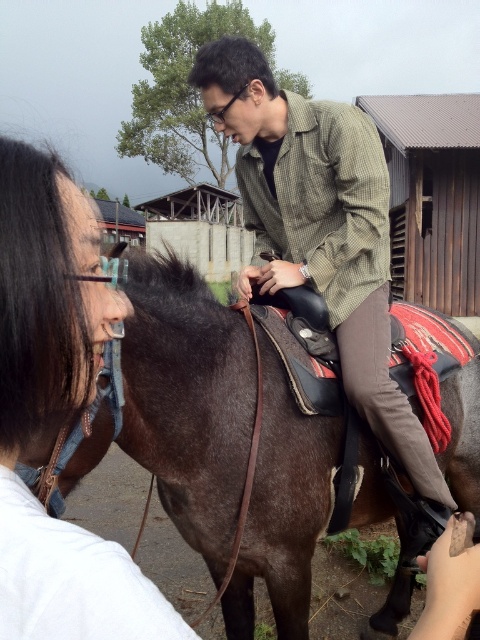
Question: Which object is the farthest from the green checkered shirt at center?

Choices:
 (A) brown leather horse at center
 (B) smooth brown hair at left

Answer: (B)

Question: Based on their relative distances, which object is farther from the brown leather horse at center?

Choices:
 (A) smooth brown hair at left
 (B) green checkered shirt at center

Answer: (A)

Question: Can you confirm if smooth brown hair at left is thinner than green checkered shirt at center?

Choices:
 (A) no
 (B) yes

Answer: (B)

Question: Considering the relative positions of brown leather horse at center and smooth brown hair at left in the image provided, where is brown leather horse at center located with respect to smooth brown hair at left?

Choices:
 (A) right
 (B) left

Answer: (A)

Question: Among these points, which one is nearest to the camera?

Choices:
 (A) (x=361, y=192)
 (B) (x=192, y=301)
 (C) (x=68, y=392)

Answer: (C)

Question: Observing the image, what is the correct spatial positioning of brown leather horse at center in reference to smooth brown hair at left?

Choices:
 (A) left
 (B) right

Answer: (B)